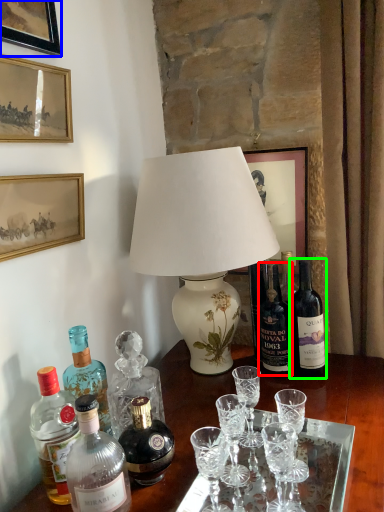
Question: Which object is the farthest from bottle (highlighted by a red box)? Choose among these: picture frame (highlighted by a blue box) or bottle (highlighted by a green box).

Choices:
 (A) picture frame
 (B) bottle

Answer: (A)